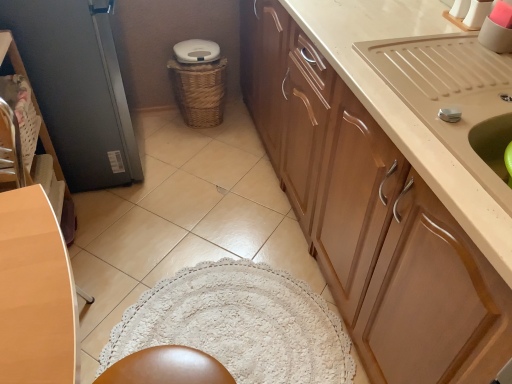
Locate an element on the screen. The image size is (512, 384). vacant space that is in between matte brown chair at left and woven brown basket at center is located at coordinates pyautogui.click(x=154, y=219).